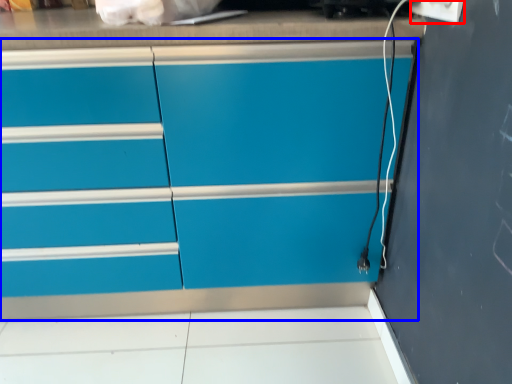
Question: Among these objects, which one is farthest to the camera, electric outlet (highlighted by a red box) or chest of drawers (highlighted by a blue box)?

Choices:
 (A) electric outlet
 (B) chest of drawers

Answer: (B)